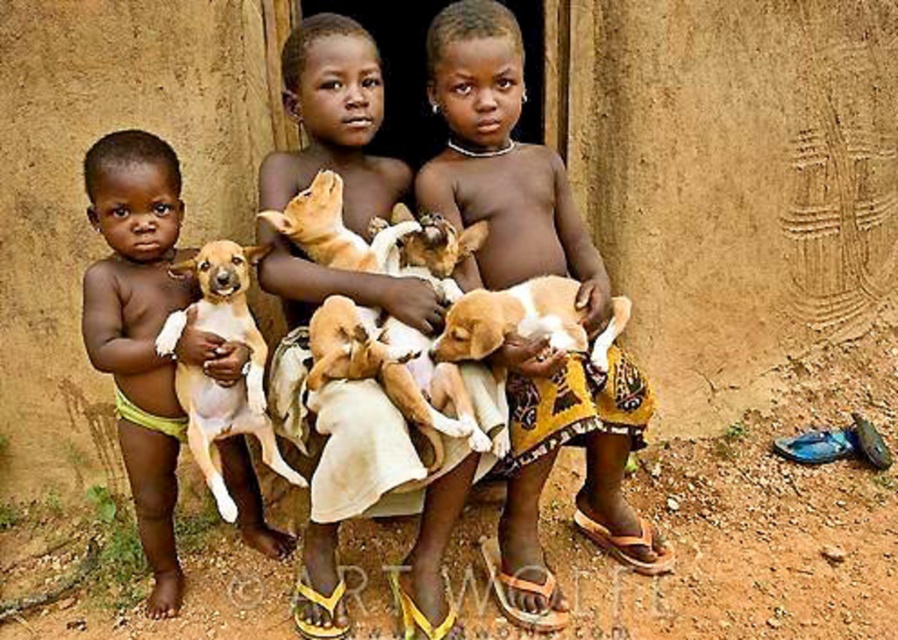
You are a photographer trying to capture a closeup of the two points in the image. Which point, point (225, 250) or point (541, 292), is positioned closer to the camera?

Point (225, 250) is closer to the camera than point (541, 292).